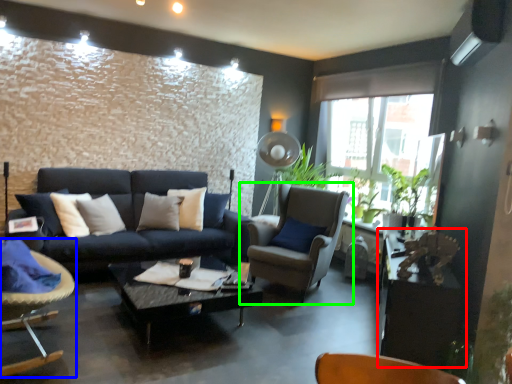
Question: Which is nearer to the table (highlighted by a red box)? chair (highlighted by a blue box) or chair (highlighted by a green box).

Choices:
 (A) chair
 (B) chair

Answer: (B)